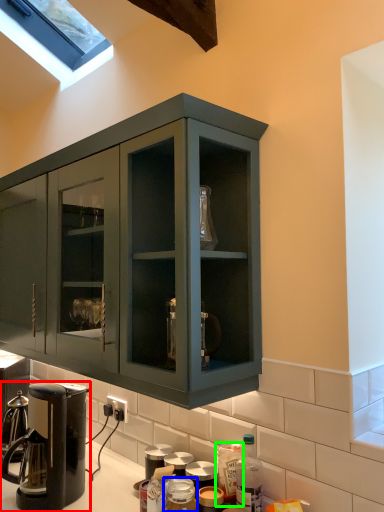
Question: Which is farther away from coffee maker (highlighted by a red box)? bottle (highlighted by a blue box) or bottle (highlighted by a green box)?

Choices:
 (A) bottle
 (B) bottle

Answer: (B)